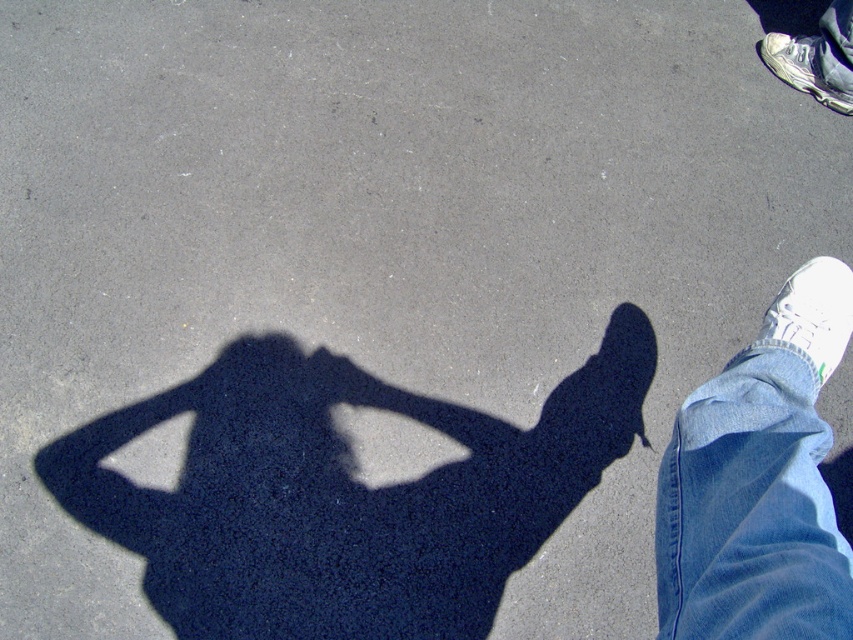
Question: Which of the following is the closest to the observer?

Choices:
 (A) blue denim jeans at lower right
 (B) white leather shoe at lower right

Answer: (A)

Question: Does blue denim jeans at lower right appear on the right side of white leather shoe at lower right?

Choices:
 (A) yes
 (B) no

Answer: (B)

Question: Which point is farther to the camera?

Choices:
 (A) white leather shoe at upper right
 (B) white leather shoe at lower right

Answer: (A)

Question: From the image, what is the correct spatial relationship of blue denim jeans at lower right in relation to white leather shoe at upper right?

Choices:
 (A) left
 (B) right

Answer: (A)

Question: Among these objects, which one is nearest to the camera?

Choices:
 (A) blue denim jeans at lower right
 (B) white leather shoe at upper right

Answer: (A)

Question: Can you confirm if white leather shoe at lower right is thinner than white leather shoe at upper right?

Choices:
 (A) no
 (B) yes

Answer: (A)